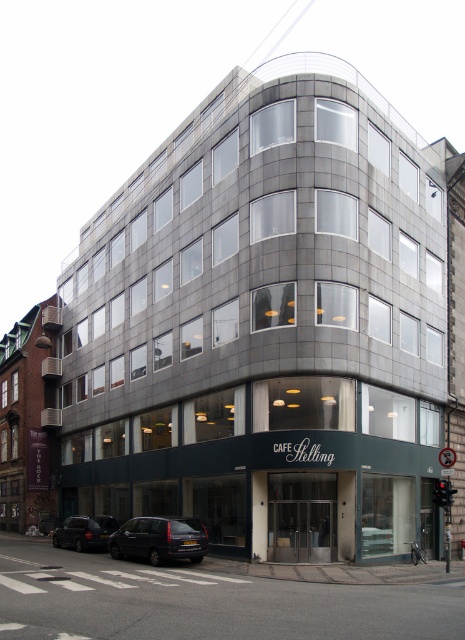
Question: Which point is farther to the camera?

Choices:
 (A) dark gray metallic car at lower left
 (B) dark gray metallic van at lower left

Answer: (A)

Question: Observing the image, what is the correct spatial positioning of dark gray metallic van at lower left in reference to dark gray metallic car at lower left?

Choices:
 (A) right
 (B) left

Answer: (A)

Question: Does dark gray metallic van at lower left have a lesser width compared to dark gray metallic car at lower left?

Choices:
 (A) no
 (B) yes

Answer: (B)

Question: Which point appears farthest from the camera in this image?

Choices:
 (A) (99, 545)
 (B) (180, 541)

Answer: (A)

Question: Which object appears farthest from the camera in this image?

Choices:
 (A) dark gray metallic van at lower left
 (B) dark gray metallic car at lower left

Answer: (B)

Question: Does dark gray metallic van at lower left appear under dark gray metallic car at lower left?

Choices:
 (A) no
 (B) yes

Answer: (A)